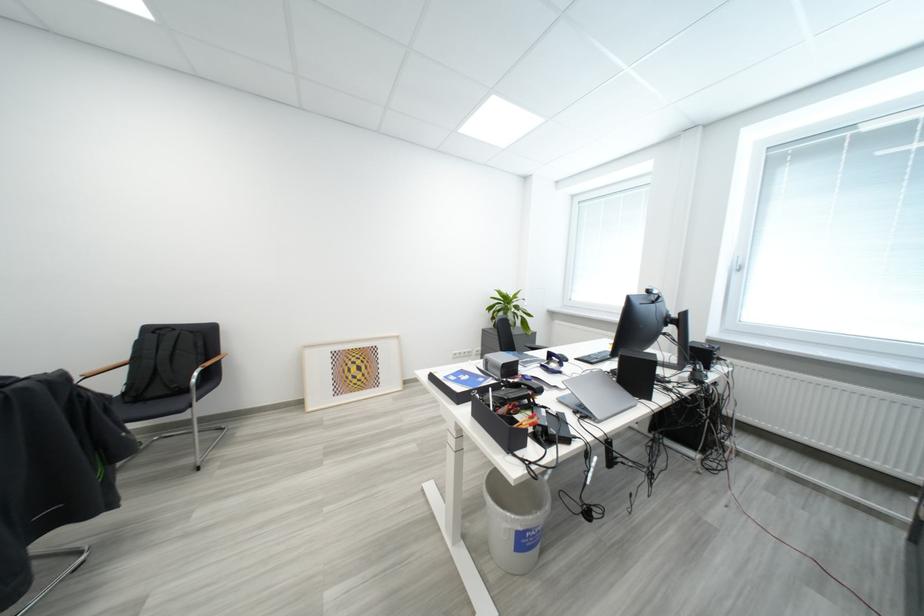
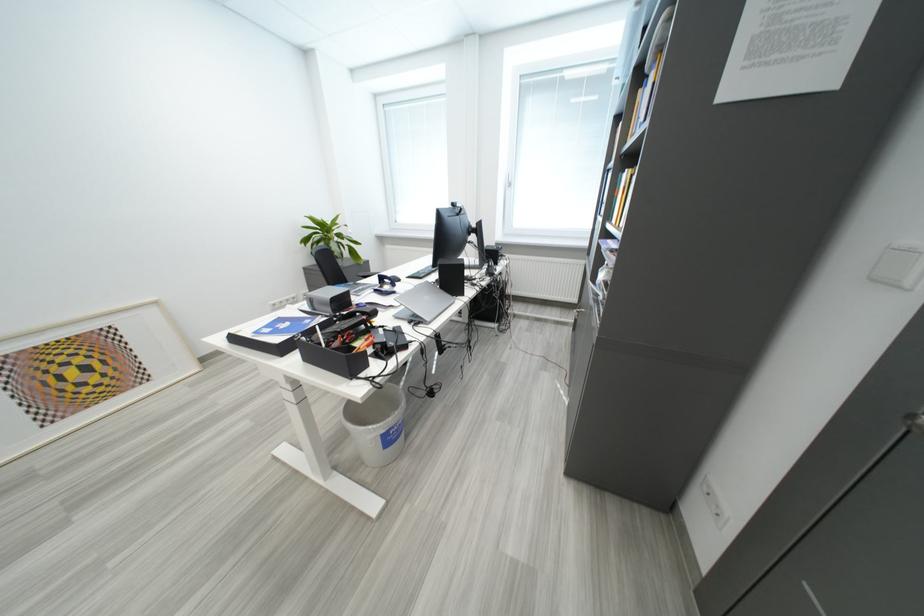
Find the pixel in the second image that matches (x=642, y=379) in the first image.

(459, 283)